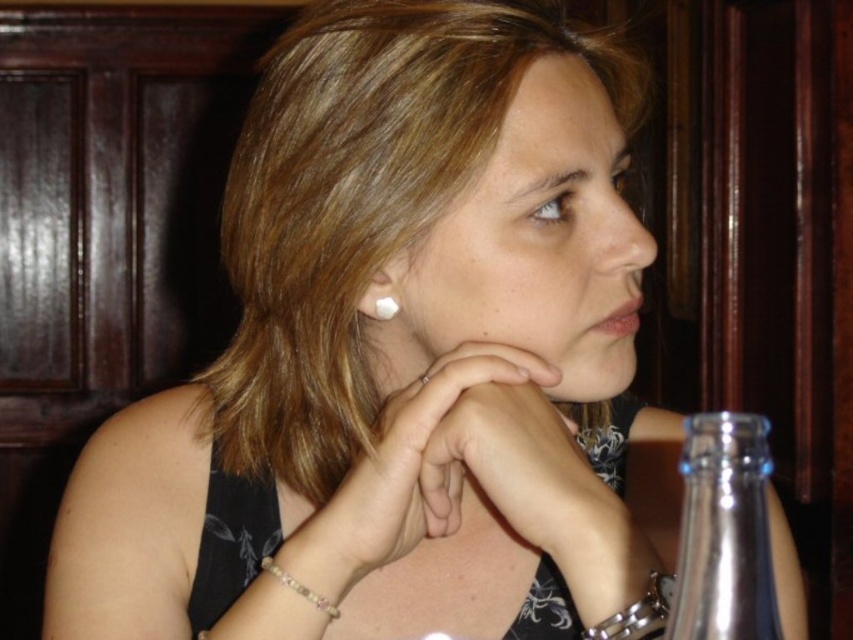
Question: Which point is farther to the camera?

Choices:
 (A) silver metallic chain at lower right
 (B) pale skin at center
 (C) clear glass bottle at right

Answer: (B)

Question: Among these objects, which one is farthest from the camera?

Choices:
 (A) pink beaded bracelet at lower center
 (B) pale skin at center
 (C) pearlelegantearring at ear
 (D) silver metallic chain at lower right

Answer: (C)

Question: Can you confirm if pink beaded bracelet at lower center is positioned to the right of pearlelegantearring at ear?

Choices:
 (A) no
 (B) yes

Answer: (A)

Question: Which point appears farthest from the camera in this image?

Choices:
 (A) (527, 364)
 (B) (651, 572)
 (C) (747, 467)

Answer: (A)

Question: Can you confirm if clear glass bottle at right is thinner than pearlelegantearring at ear?

Choices:
 (A) no
 (B) yes

Answer: (A)

Question: Does clear glass bottle at right appear under pink beaded bracelet at lower center?

Choices:
 (A) no
 (B) yes

Answer: (A)